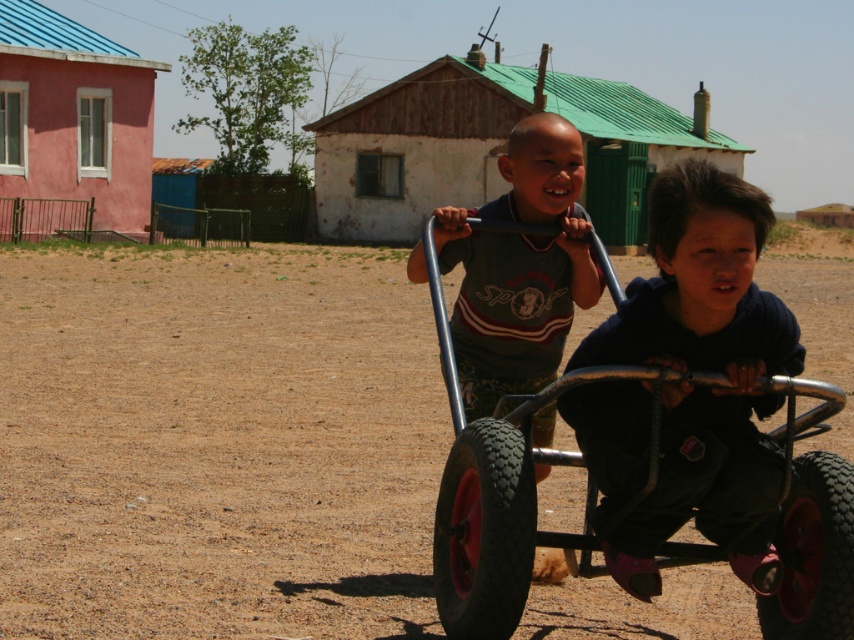
Question: Which of these objects is positioned closest to the metallic matte tricycle at center?

Choices:
 (A) black rubber wheel at lower right
 (B) white painted wood hut at center
 (C) dark blue fleece at center

Answer: (C)

Question: Can you confirm if rubber/textured wheel at lower center is thinner than black rubber wheel at lower right?

Choices:
 (A) yes
 (B) no

Answer: (B)

Question: Which point is farther to the camera?

Choices:
 (A) (817, 541)
 (B) (104, 164)
 (C) (282, 464)
 (D) (847, 563)

Answer: (B)

Question: Does matte gray shirt at center appear over black rubber wheel at lower right?

Choices:
 (A) yes
 (B) no

Answer: (A)

Question: Does dark blue fleece at center come in front of matte gray shirt at center?

Choices:
 (A) no
 (B) yes

Answer: (B)

Question: Among these objects, which one is farthest from the camera?

Choices:
 (A) rubber/textured wheel at lower center
 (B) matte gray shirt at center
 (C) metallic matte tricycle at center

Answer: (B)